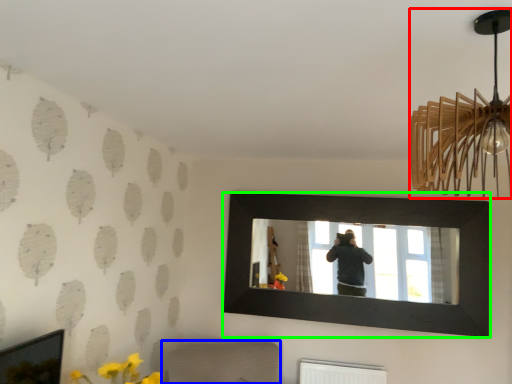
Question: Which object is positioned farthest from lamp (highlighted by a red box)? Select from furniture (highlighted by a blue box) and picture frame (highlighted by a green box).

Choices:
 (A) furniture
 (B) picture frame

Answer: (A)